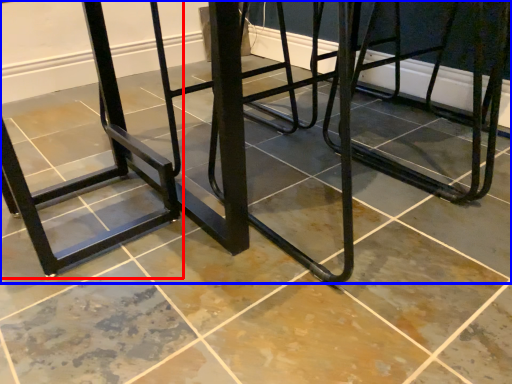
Question: Which of the following is the farthest to the observer, bar stool (highlighted by a red box) or furniture (highlighted by a blue box)?

Choices:
 (A) bar stool
 (B) furniture

Answer: (A)